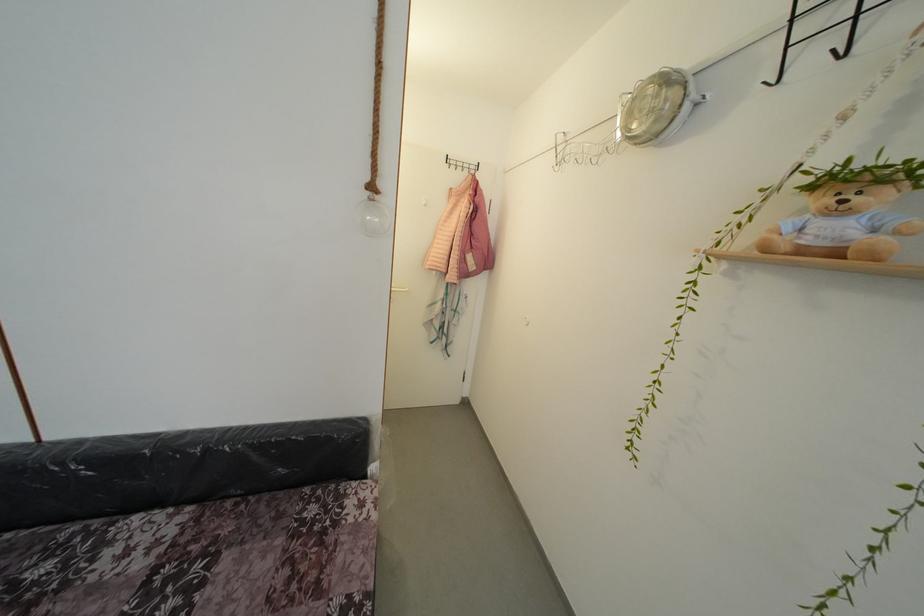
Where would you sit the sofa sitting surface? Please return your answer as a coordinate pair (x, y).

(202, 559)